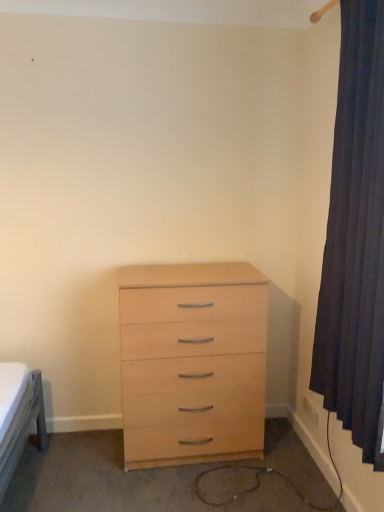
Identify the location of vacant area to the right of light wood chest of drawers at center. (284, 467).